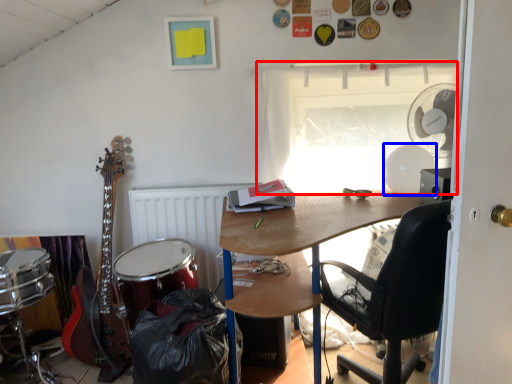
Question: Which of the following is the closest to the observer, window (highlighted by a red box) or mechanical fan (highlighted by a blue box)?

Choices:
 (A) window
 (B) mechanical fan

Answer: (B)